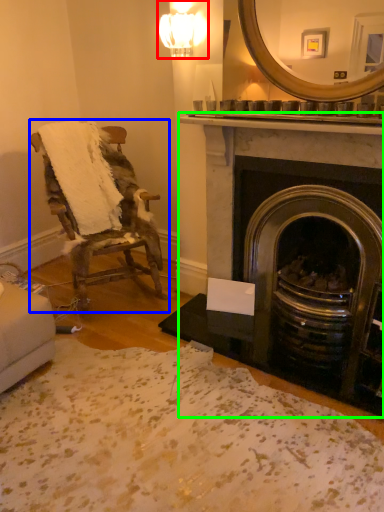
Question: Based on their relative distances, which object is nearer to light fixture (highlighted by a red box)? Choose from chair (highlighted by a blue box) and fireplace (highlighted by a green box).

Choices:
 (A) chair
 (B) fireplace

Answer: (B)